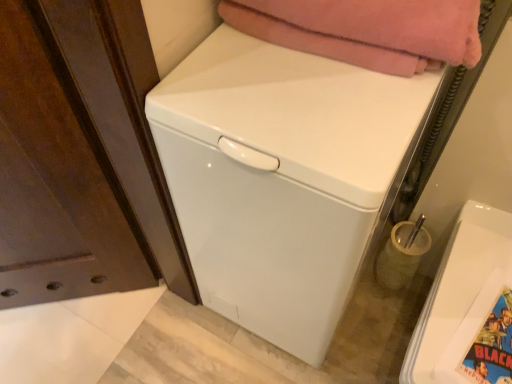
This screenshot has height=384, width=512. I want to click on free region on the left part of colorful glossy comic book at lower right, so click(444, 339).